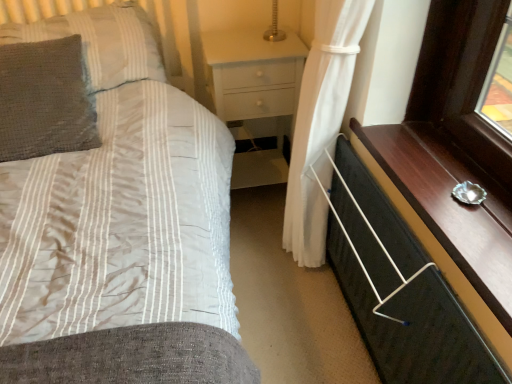
Question: Is gray textured pillow at left, acting as the first pillow starting from the bottom, at the right side of black fabric chest of drawers at lower right?

Choices:
 (A) no
 (B) yes

Answer: (A)

Question: Is gray textured pillow at left, acting as the first pillow starting from the bottom, oriented towards black fabric chest of drawers at lower right?

Choices:
 (A) no
 (B) yes

Answer: (A)

Question: Can you confirm if gray textured pillow at left, which ranks as the 2th pillow in top-to-bottom order, is positioned to the left of black fabric chest of drawers at lower right?

Choices:
 (A) no
 (B) yes

Answer: (B)

Question: Is gray textured pillow at left, acting as the first pillow starting from the bottom, not within black fabric chest of drawers at lower right?

Choices:
 (A) yes
 (B) no

Answer: (A)

Question: Can you confirm if gray textured pillow at left, acting as the first pillow starting from the bottom, is wider than black fabric chest of drawers at lower right?

Choices:
 (A) no
 (B) yes

Answer: (B)

Question: From a real-world perspective, is matte striped fabric bed at center positioned above or below black fabric chest of drawers at lower right?

Choices:
 (A) below
 (B) above

Answer: (B)

Question: From the image's perspective, relative to black fabric chest of drawers at lower right, is matte striped fabric bed at center above or below?

Choices:
 (A) below
 (B) above

Answer: (B)

Question: Is matte striped fabric bed at center bigger or smaller than black fabric chest of drawers at lower right?

Choices:
 (A) small
 (B) big

Answer: (B)

Question: In terms of width, does matte striped fabric bed at center look wider or thinner when compared to black fabric chest of drawers at lower right?

Choices:
 (A) thin
 (B) wide

Answer: (B)

Question: Based on their sizes in the image, would you say matte striped fabric bed at center is bigger or smaller than gray textured pillow at upper left, positioned as the second pillow in bottom-to-top order?

Choices:
 (A) small
 (B) big

Answer: (B)

Question: From their relative heights in the image, would you say matte striped fabric bed at center is taller or shorter than gray textured pillow at upper left, positioned as the second pillow in bottom-to-top order?

Choices:
 (A) tall
 (B) short

Answer: (A)

Question: Considering the positions of matte striped fabric bed at center and gray textured pillow at upper left, positioned as the second pillow in bottom-to-top order, in the image, is matte striped fabric bed at center wider or thinner than gray textured pillow at upper left, positioned as the second pillow in bottom-to-top order,?

Choices:
 (A) thin
 (B) wide

Answer: (B)

Question: From the image's perspective, relative to gray textured pillow at upper left, positioned as the second pillow in bottom-to-top order, is matte striped fabric bed at center above or below?

Choices:
 (A) above
 (B) below

Answer: (B)

Question: Visually, is gray textured pillow at left, acting as the first pillow starting from the bottom, positioned to the left or to the right of white glossy nightstand at center?

Choices:
 (A) left
 (B) right

Answer: (A)

Question: Considering their positions, is gray textured pillow at left, acting as the first pillow starting from the bottom, located in front of or behind white glossy nightstand at center?

Choices:
 (A) behind
 (B) front

Answer: (B)